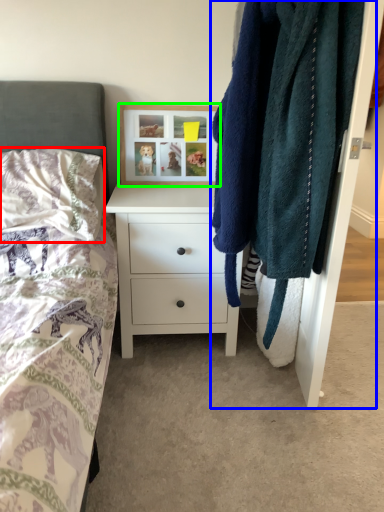
Question: Which object is the farthest from pillow (highlighted by a red box)? Choose among these: closet (highlighted by a blue box) or picture frame (highlighted by a green box).

Choices:
 (A) closet
 (B) picture frame

Answer: (A)